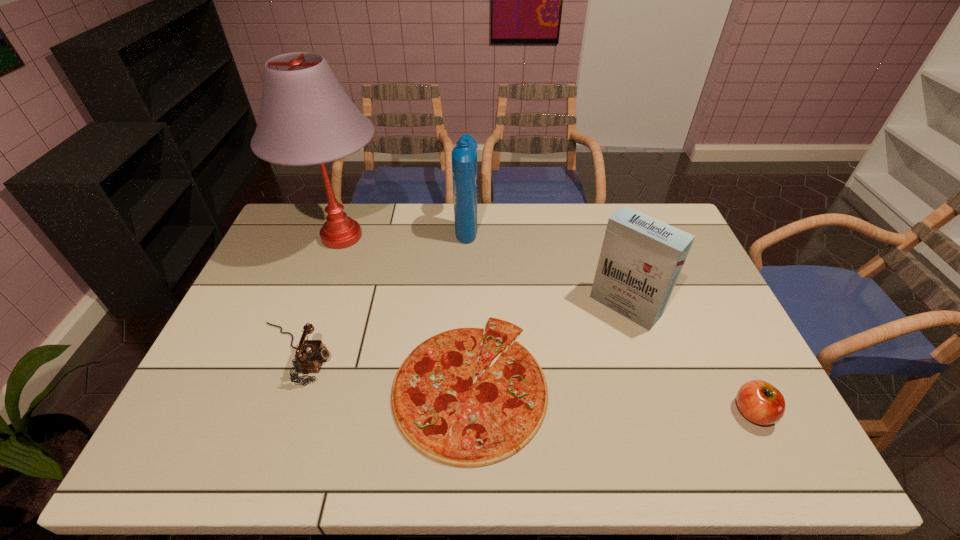
The image size is (960, 540). In order to click on object located at the far left corner in this screenshot , I will do `click(306, 118)`.

Find the location of a particular element. object positioned at the near right corner is located at coordinates (760, 402).

This screenshot has width=960, height=540. What are the coordinates of `blank space at the far edge` in the screenshot? It's located at click(x=385, y=213).

You are a GUI agent. You are given a task and a screenshot of the screen. Output one action in this format:
    pyautogui.click(x=<x>, y=<y>)
    Task: Click on the vacant space at the near edge of the desktop
    The height and width of the screenshot is (540, 960).
    Given the screenshot: What is the action you would take?
    pyautogui.click(x=716, y=451)

In the image, there is a desktop. Identify the location of free space at the left edge. (273, 284).

In the image, there is a desktop. Where is `free space at the right edge`? This screenshot has height=540, width=960. free space at the right edge is located at coordinates (733, 369).

This screenshot has width=960, height=540. In the image, there is a desktop. Identify the location of vacant space at the far left corner. (322, 212).

Identify the location of vacant area at the near left corner. The width and height of the screenshot is (960, 540). (214, 468).

Find the location of a particular element. vacant space at the far right corner is located at coordinates (662, 221).

Locate an element on the screen. vacant area between the rightmost object and the table lamp is located at coordinates (547, 325).